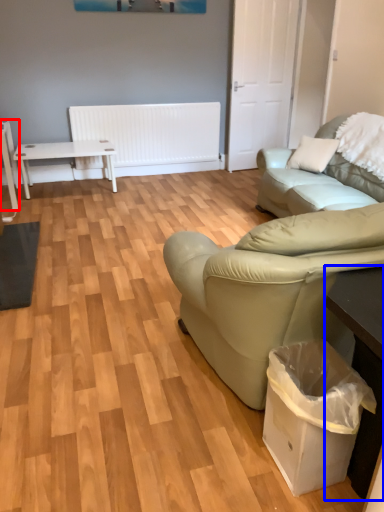
Question: Among these objects, which one is nearest to the camera, table (highlighted by a red box) or table (highlighted by a blue box)?

Choices:
 (A) table
 (B) table

Answer: (B)